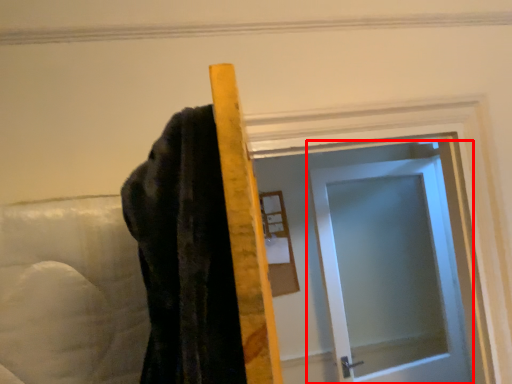
Question: From the image's perspective, what is the correct spatial positioning of door (annotated by the red box) in reference to mirror?

Choices:
 (A) above
 (B) below

Answer: (B)